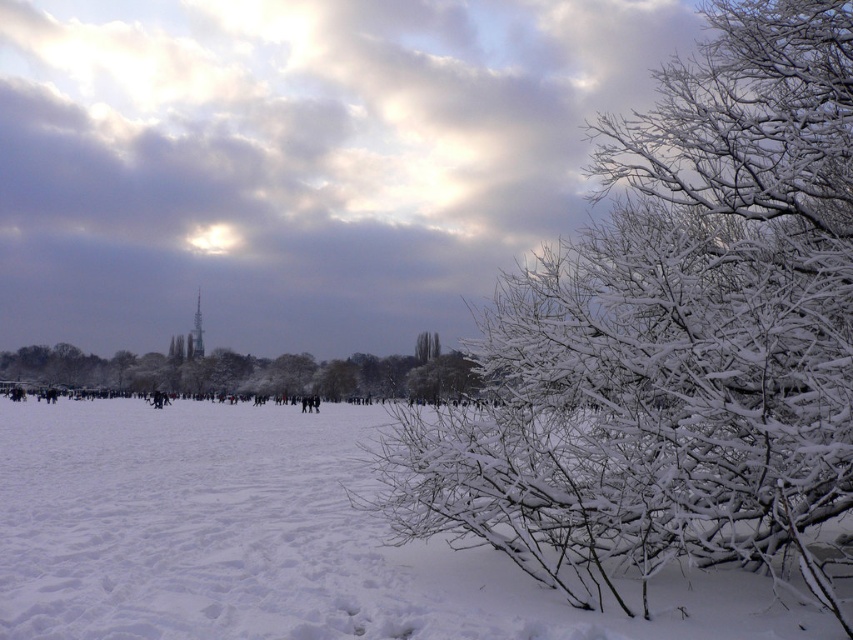
You are standing in the winter scene and want to take a closer look at the white frosty branches at lower right. If you walk 5 meters towards them, will you reach them?

The white frosty branches at lower right are 6.68 meters away. After walking 5 meters, you will still be 1.68 meters away from them, so you haven not reached them yet.